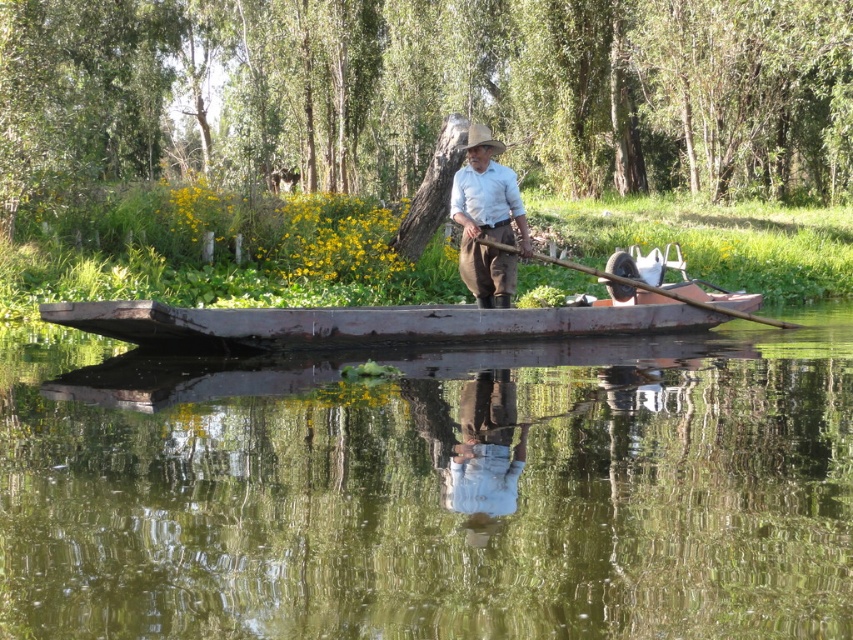
The height and width of the screenshot is (640, 853). What are the coordinates of `green smooth water at center` in the screenshot? It's located at tap(431, 490).

Looking at this image, who is more distant from viewer, (427, 481) or (476, 248)?

The point (476, 248) is behind.

The image size is (853, 640). In order to click on green smooth water at center in this screenshot , I will do `click(431, 490)`.

Image resolution: width=853 pixels, height=640 pixels. What do you see at coordinates (412, 317) in the screenshot?
I see `rusty wood boat at center` at bounding box center [412, 317].

Which is in front, point (669, 285) or point (502, 259)?

Positioned in front is point (502, 259).

Image resolution: width=853 pixels, height=640 pixels. Find the location of `rusty wood boat at center`. rusty wood boat at center is located at coordinates (412, 317).

Is light brown cotton shirt at center below wooden at center?

Incorrect, light brown cotton shirt at center is not positioned below wooden at center.

Measure the distance between point (495,232) and camera.

They are 39.45 feet apart.

The image size is (853, 640). Identify the location of light brown cotton shirt at center. (486, 220).

The image size is (853, 640). I want to click on light brown cotton shirt at center, so click(x=486, y=220).